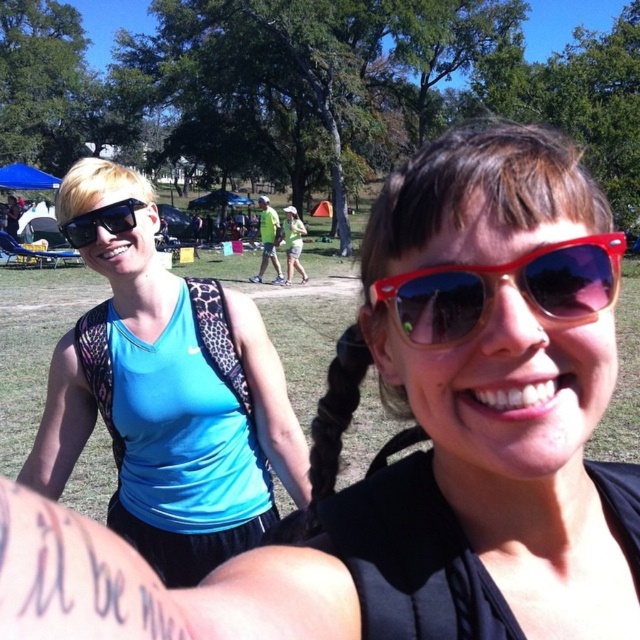
Between blue leopard print tank top at left and red plastic sunglasses at center, which one has less height?

Standing shorter between the two is red plastic sunglasses at center.

Is point (157, 316) farther from viewer compared to point (557, 308)?

Yes.

You are a GUI agent. You are given a task and a screenshot of the screen. Output one action in this format:
    pyautogui.click(x=<x>, y=<y>)
    Task: Click on the blue leopard print tank top at left
    This screenshot has height=640, width=640.
    Given the screenshot: What is the action you would take?
    pyautogui.click(x=168, y=396)

Can you confirm if blue leopard print tank top at left is shorter than matte black sunglasses at left?

No, blue leopard print tank top at left is not shorter than matte black sunglasses at left.

Who is more forward, [252,442] or [77,216]?

Point [77,216] is in front.

Identify the location of blue leopard print tank top at left. This screenshot has width=640, height=640. (x=168, y=396).

From the picture: Is red plastic sunglasses at center to the left of matte black sunglasses at left from the viewer's perspective?

No, red plastic sunglasses at center is not to the left of matte black sunglasses at left.

Can you confirm if red plastic sunglasses at center is wider than matte black sunglasses at left?

No.

Who is more forward, (417,269) or (64,236)?

Point (417,269) is more forward.

At what (x,y) coordinates should I click in order to perform the action: click on red plastic sunglasses at center. Please return your answer as a coordinate pair (x, y). This screenshot has width=640, height=640. Looking at the image, I should click on pyautogui.click(x=502, y=280).